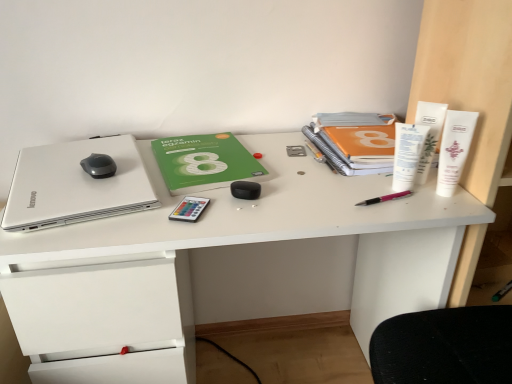
Find the location of a particular element. The width and height of the screenshot is (512, 384). free space in front of orange matte notebook at upper right, acting as the 1th paperback book starting from the right is located at coordinates (364, 195).